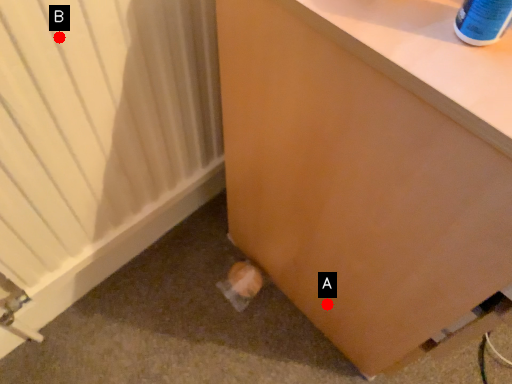
Question: Two points are circled on the image, labeled by A and B beside each circle. Which point appears closest to the camera in this image?

Choices:
 (A) A is closer
 (B) B is closer

Answer: (B)